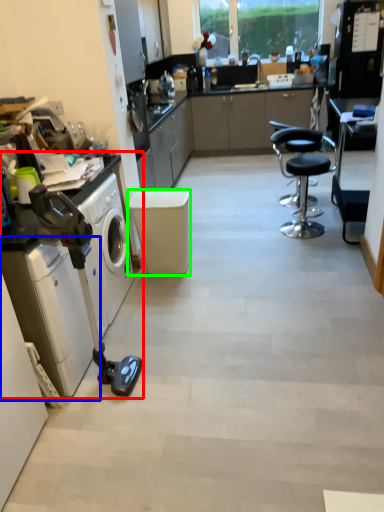
Question: Which is farther away from home appliance (highlighted by a red box)? washing machine (highlighted by a blue box) or stool (highlighted by a green box)?

Choices:
 (A) washing machine
 (B) stool

Answer: (B)